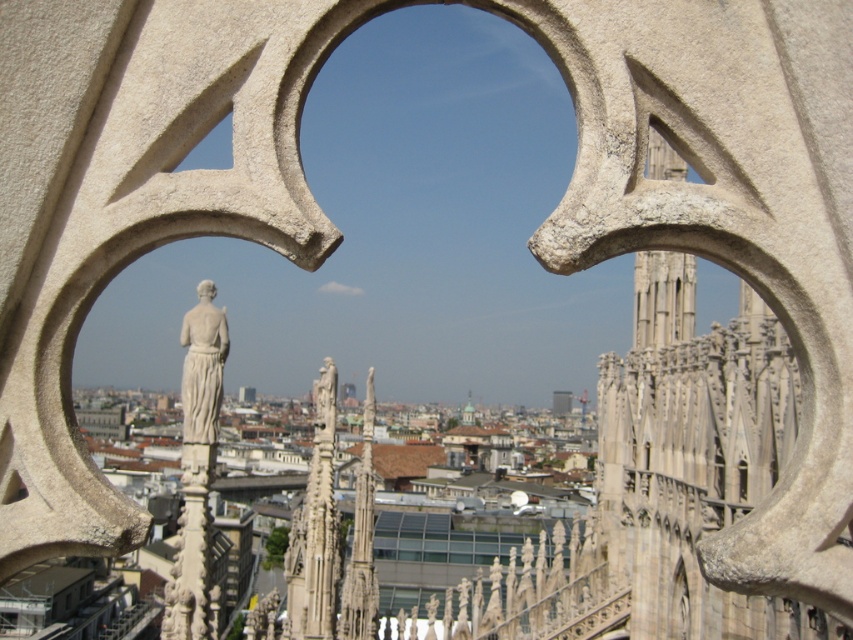
Which is more to the right, stone gothic spire at upper right or white marble statue at center?

stone gothic spire at upper right

Who is taller, stone gothic spire at upper right or white marble statue at center?

With more height is stone gothic spire at upper right.

Describe the element at coordinates (663, 298) in the screenshot. I see `stone gothic spire at upper right` at that location.

The height and width of the screenshot is (640, 853). What are the coordinates of `stone gothic spire at upper right` in the screenshot? It's located at (663, 298).